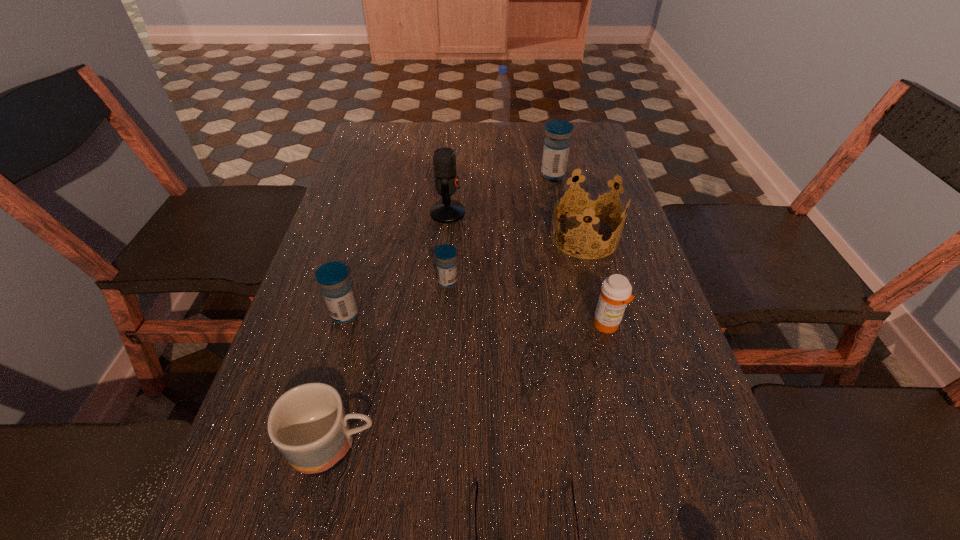
Select which object is the fifth closest to the eighth nearest object. Please provide its 2D coordinates. Your answer should be formatted as a tuple, i.e. [(x, y)], where the tuple contains the x and y coordinates of a point satisfying the conditions above.

[(616, 290)]

Identify which medicine is located as the third nearest to the crown. Please provide its 2D coordinates. Your answer should be formatted as a tuple, i.e. [(x, y)], where the tuple contains the x and y coordinates of a point satisfying the conditions above.

[(446, 263)]

Image resolution: width=960 pixels, height=540 pixels. I want to click on the second closest medicine to the tallest medicine, so click(x=616, y=290).

Choose which blue medicine is the nearest neighbor to the tallest medicine. Please provide its 2D coordinates. Your answer should be formatted as a tuple, i.e. [(x, y)], where the tuple contains the x and y coordinates of a point satisfying the conditions above.

[(446, 263)]

What are the coordinates of `blue medicine that stands as the closest to the second blue medicine from left to right` in the screenshot? It's located at (333, 277).

Locate an element on the screen. vacant region that satisfies the following two spatial constraints: 1. on the front side of the crown; 2. on the side with the handle of the blue mug is located at coordinates (638, 444).